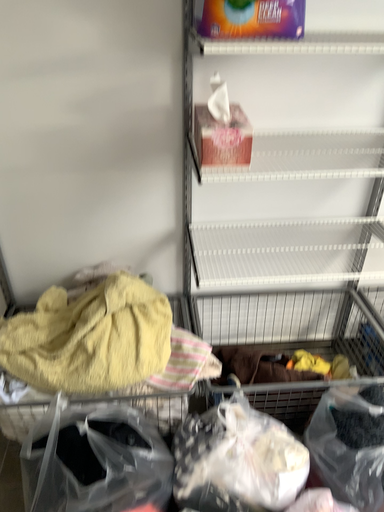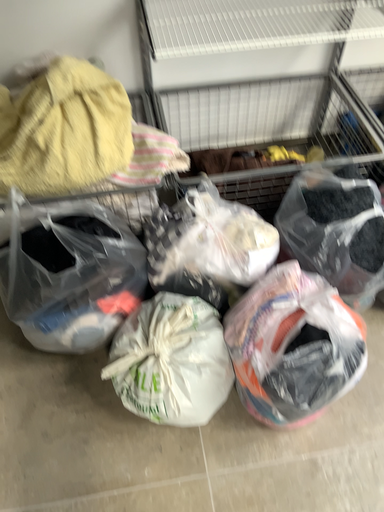
Question: Which way did the camera rotate in the video?

Choices:
 (A) rotated downward
 (B) rotated upward

Answer: (A)